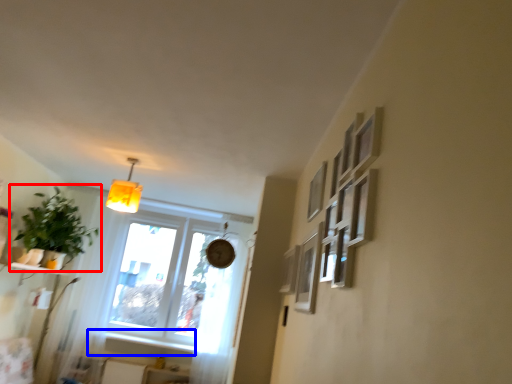
Question: Which point is closer to the camera, houseplant (highlighted by a red box) or window sill (highlighted by a blue box)?

Choices:
 (A) houseplant
 (B) window sill

Answer: (A)